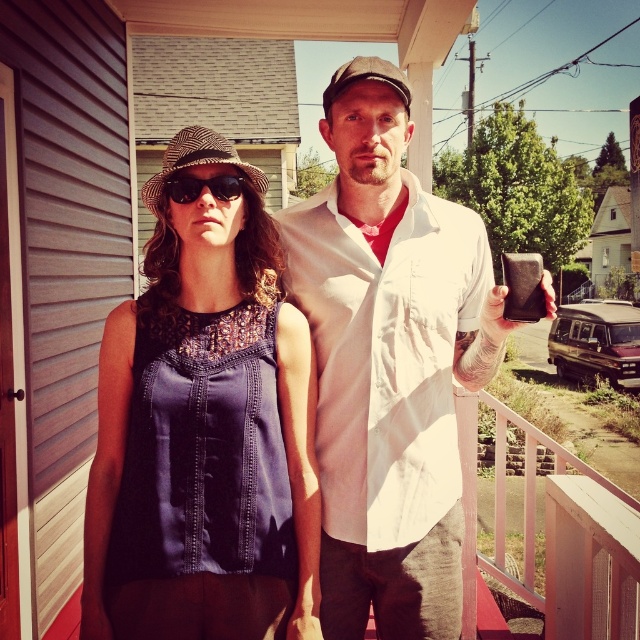
You are a delivery person who needs to leave a package for the residents. The package can only be placed on the white cotton shirt at center. Based on the scene description, where exactly should you place the package?

The package should be placed at the coordinates point [388,362] where the white cotton shirt at center is located.